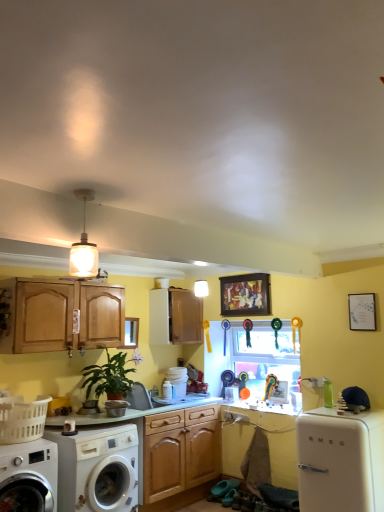
Question: Considering the relative positions of white glass pendant light at upper center and green matte plant at lower left in the image provided, is white glass pendant light at upper center to the right of green matte plant at lower left from the viewer's perspective?

Choices:
 (A) yes
 (B) no

Answer: (A)

Question: From a real-world perspective, is white glass pendant light at upper center physically below green matte plant at lower left?

Choices:
 (A) no
 (B) yes

Answer: (A)

Question: Does white glass pendant light at upper center come in front of green matte plant at lower left?

Choices:
 (A) no
 (B) yes

Answer: (B)

Question: Does white glass pendant light at upper center have a lesser width compared to green matte plant at lower left?

Choices:
 (A) yes
 (B) no

Answer: (A)

Question: Is green matte plant at lower left at the back of white glass pendant light at upper center?

Choices:
 (A) no
 (B) yes

Answer: (A)

Question: Would you say white glossy washing machine at lower left, the 1th washing machine when ordered from left to right, is inside or outside green matte countertop at center?

Choices:
 (A) inside
 (B) outside

Answer: (B)

Question: From the image's perspective, relative to green matte countertop at center, is white glossy washing machine at lower left, which is counted as the second washing machine, starting from the right, above or below?

Choices:
 (A) above
 (B) below

Answer: (B)

Question: Relative to green matte countertop at center, is white glossy washing machine at lower left, the 1th washing machine when ordered from left to right, in front or behind?

Choices:
 (A) behind
 (B) front

Answer: (B)

Question: Looking at the image, does white glossy washing machine at lower left, which is counted as the second washing machine, starting from the right, seem bigger or smaller compared to green matte countertop at center?

Choices:
 (A) small
 (B) big

Answer: (B)

Question: From their relative heights in the image, would you say green matte countertop at center is taller or shorter than metallic silver washing machine at lower left?

Choices:
 (A) tall
 (B) short

Answer: (A)

Question: From the image's perspective, is green matte countertop at center positioned above or below metallic silver washing machine at lower left?

Choices:
 (A) above
 (B) below

Answer: (B)

Question: Is green matte countertop at center bigger or smaller than metallic silver washing machine at lower left?

Choices:
 (A) big
 (B) small

Answer: (A)

Question: In the image, is green matte countertop at center positioned in front of or behind metallic silver washing machine at lower left?

Choices:
 (A) front
 (B) behind

Answer: (B)

Question: Considering the positions of white glossy refrigerator at lower right and white glossy washing machine at lower left, positioned as the 1th washing machine in right-to-left order, in the image, is white glossy refrigerator at lower right bigger or smaller than white glossy washing machine at lower left, positioned as the 1th washing machine in right-to-left order,?

Choices:
 (A) big
 (B) small

Answer: (B)

Question: Considering the relative positions of white glossy refrigerator at lower right and white glossy washing machine at lower left, positioned as the 1th washing machine in right-to-left order, in the image provided, is white glossy refrigerator at lower right to the left or to the right of white glossy washing machine at lower left, positioned as the 1th washing machine in right-to-left order,?

Choices:
 (A) left
 (B) right

Answer: (B)